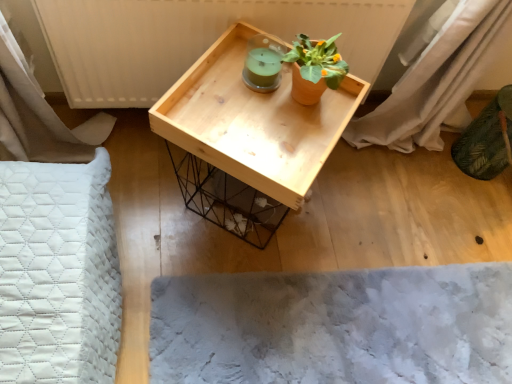
Question: From the image's perspective, is natural wood tray at center under fuzzy gray mat at lower center?

Choices:
 (A) no
 (B) yes

Answer: (A)

Question: From a real-world perspective, is natural wood tray at center physically below fuzzy gray mat at lower center?

Choices:
 (A) yes
 (B) no

Answer: (B)

Question: Does natural wood tray at center come in front of fuzzy gray mat at lower center?

Choices:
 (A) yes
 (B) no

Answer: (A)

Question: Is natural wood tray at center smaller than fuzzy gray mat at lower center?

Choices:
 (A) no
 (B) yes

Answer: (A)

Question: Does natural wood tray at center have a greater height compared to fuzzy gray mat at lower center?

Choices:
 (A) no
 (B) yes

Answer: (B)

Question: Is fuzzy gray mat at lower center a part of natural wood tray at center?

Choices:
 (A) yes
 (B) no

Answer: (B)

Question: Considering the relative sizes of terracotta clay pot at upper center and natural wood tray at center in the image provided, is terracotta clay pot at upper center taller than natural wood tray at center?

Choices:
 (A) yes
 (B) no

Answer: (B)

Question: Is terracotta clay pot at upper center positioned behind natural wood tray at center?

Choices:
 (A) yes
 (B) no

Answer: (A)

Question: From a real-world perspective, is terracotta clay pot at upper center positioned under natural wood tray at center based on gravity?

Choices:
 (A) yes
 (B) no

Answer: (B)

Question: Can you confirm if terracotta clay pot at upper center is shorter than natural wood tray at center?

Choices:
 (A) yes
 (B) no

Answer: (A)

Question: Considering the relative sizes of terracotta clay pot at upper center and natural wood tray at center in the image provided, is terracotta clay pot at upper center thinner than natural wood tray at center?

Choices:
 (A) no
 (B) yes

Answer: (B)

Question: Does terracotta clay pot at upper center turn towards natural wood tray at center?

Choices:
 (A) no
 (B) yes

Answer: (A)

Question: Is natural wood tray at center oriented towards terracotta clay pot at upper center?

Choices:
 (A) yes
 (B) no

Answer: (B)